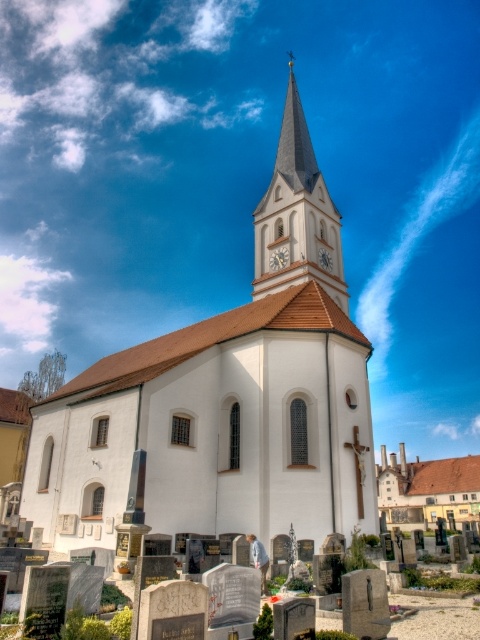
Is white matte church at center wider than smooth gray steeple at center?

Correct, the width of white matte church at center exceeds that of smooth gray steeple at center.

The image size is (480, 640). What do you see at coordinates (225, 400) in the screenshot?
I see `white matte church at center` at bounding box center [225, 400].

Between point (356, 417) and point (300, 125), which one is positioned behind?

The point (300, 125) is more distant.

At what (x,y) coordinates should I click in order to perform the action: click on white matte church at center. Please return your answer as a coordinate pair (x, y). Looking at the image, I should click on (225, 400).

Does white matte church at center appear under smooth gray stone gravestone at lower center?

No, white matte church at center is not below smooth gray stone gravestone at lower center.

Which is below, white matte church at center or smooth gray stone gravestone at lower center?

smooth gray stone gravestone at lower center is lower down.

Between point (332, 256) and point (376, 612), which one is positioned in front?

Positioned in front is point (376, 612).

Where is `white matte church at center`? Image resolution: width=480 pixels, height=640 pixels. white matte church at center is located at coordinates (225, 400).

Which is below, marble gravestones at lower center or metallic clock face at center?

Positioned lower is marble gravestones at lower center.

Does marble gravestones at lower center appear on the left side of metallic clock face at center?

Correct, you'll find marble gravestones at lower center to the left of metallic clock face at center.

The height and width of the screenshot is (640, 480). Identify the location of marble gravestones at lower center. (436, 618).